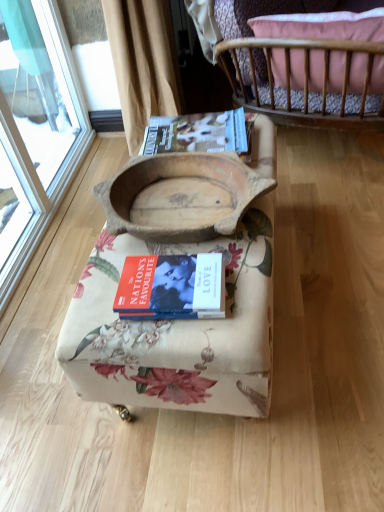
Question: Is hardcover magazine at upper center positioned beyond the bounds of wooden bowl at center?

Choices:
 (A) no
 (B) yes

Answer: (B)

Question: Does hardcover magazine at upper center turn towards wooden bowl at center?

Choices:
 (A) yes
 (B) no

Answer: (B)

Question: Is the depth of hardcover magazine at upper center greater than that of wooden bowl at center?

Choices:
 (A) no
 (B) yes

Answer: (B)

Question: Considering the relative sizes of hardcover magazine at upper center and wooden bowl at center in the image provided, is hardcover magazine at upper center shorter than wooden bowl at center?

Choices:
 (A) no
 (B) yes

Answer: (B)

Question: Is wooden bowl at center at the back of hardcover magazine at upper center?

Choices:
 (A) no
 (B) yes

Answer: (A)

Question: From a real-world perspective, is hardcover magazine at upper center positioned under wooden bowl at center based on gravity?

Choices:
 (A) no
 (B) yes

Answer: (B)

Question: Is wooden bowl at center, arranged as the 2th furniture when viewed from the top, surrounded by wooden crib at upper right, which is the 1th furniture from top to bottom?

Choices:
 (A) yes
 (B) no

Answer: (B)

Question: Does wooden crib at upper right, acting as the second furniture starting from the bottom, have a smaller size compared to wooden bowl at center, acting as the 1th furniture starting from the bottom?

Choices:
 (A) yes
 (B) no

Answer: (A)

Question: Is wooden crib at upper right, which is the 1th furniture from top to bottom, taller than wooden bowl at center, arranged as the 2th furniture when viewed from the top?

Choices:
 (A) yes
 (B) no

Answer: (A)

Question: Is wooden crib at upper right, which is the 1th furniture from top to bottom, outside wooden bowl at center, arranged as the 2th furniture when viewed from the top?

Choices:
 (A) no
 (B) yes

Answer: (B)

Question: Is wooden crib at upper right, acting as the second furniture starting from the bottom, in front of wooden bowl at center, acting as the 1th furniture starting from the bottom?

Choices:
 (A) yes
 (B) no

Answer: (B)

Question: Are wooden crib at upper right, acting as the second furniture starting from the bottom, and wooden bowl at center, arranged as the 2th furniture when viewed from the top, beside each other?

Choices:
 (A) yes
 (B) no

Answer: (B)

Question: Considering the relative positions of hardcover magazine at upper center and hardcover book at center in the image provided, is hardcover magazine at upper center in front of hardcover book at center?

Choices:
 (A) no
 (B) yes

Answer: (A)